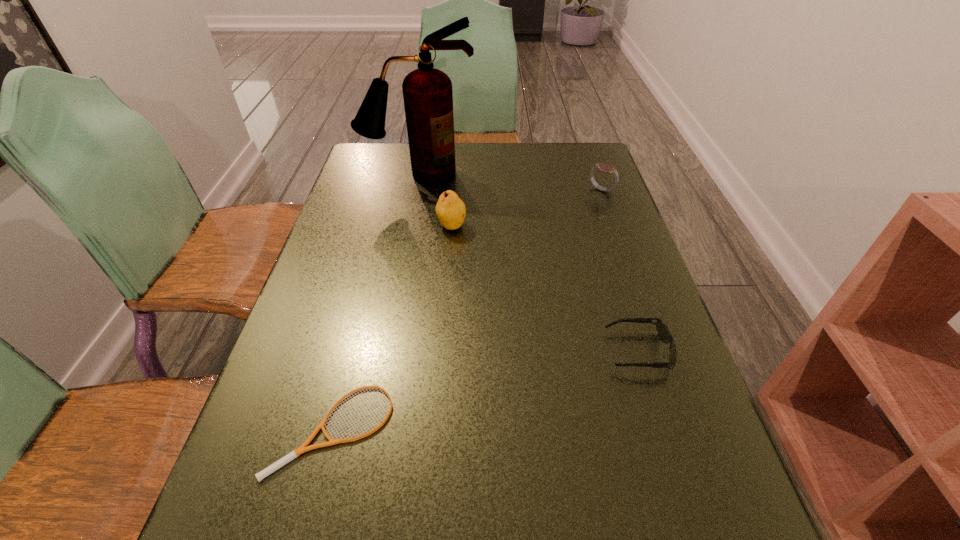
At what (x,y) coordinates should I click in order to perform the action: click on vacant area situated on the front of the watch. Please return your answer as a coordinate pair (x, y). The image size is (960, 540). Looking at the image, I should click on (638, 293).

The width and height of the screenshot is (960, 540). I want to click on free space located on the front-facing side of the fourth tallest object, so click(567, 351).

The height and width of the screenshot is (540, 960). Find the location of `free location located 0.070m on the front-facing side of the fourth tallest object`. free location located 0.070m on the front-facing side of the fourth tallest object is located at coordinates (572, 351).

Find the location of a particular element. The image size is (960, 540). free space located 0.160m on the front-facing side of the fourth tallest object is located at coordinates (528, 351).

I want to click on free location located on the right of the nearest object, so click(x=628, y=428).

This screenshot has width=960, height=540. In order to click on object that is at the far edge in this screenshot , I will do `click(427, 92)`.

Locate an element on the screen. fire extinguisher located at the left edge is located at coordinates (427, 92).

The image size is (960, 540). Find the location of `tennis racket present at the left edge`. tennis racket present at the left edge is located at coordinates (292, 455).

I want to click on watch positioned at the right edge, so tap(604, 167).

At what (x,y) coordinates should I click in order to perform the action: click on sunglasses located in the right edge section of the desktop. Please return your answer as a coordinate pair (x, y). Looking at the image, I should click on (663, 332).